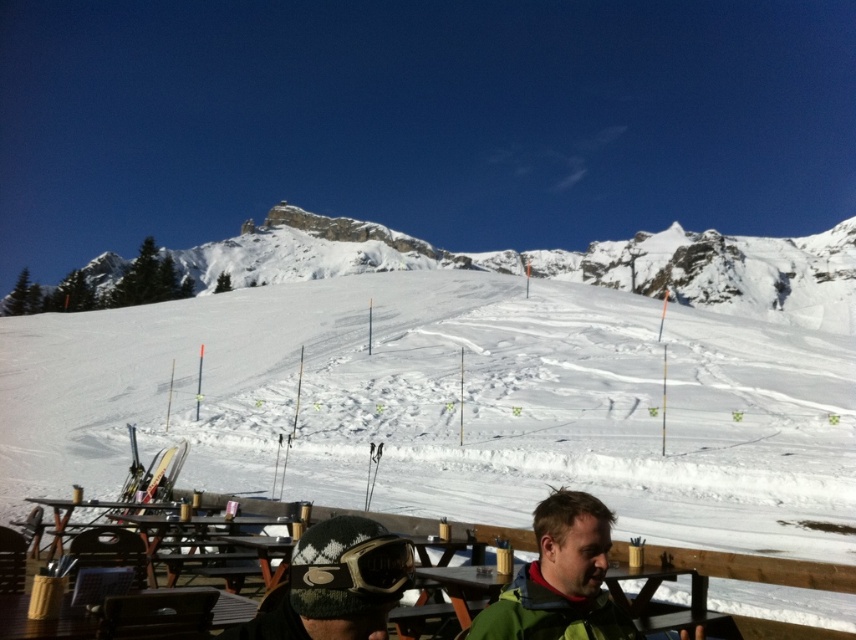
Question: Considering the real-world distances, which object is farthest from the matte black goggles at center?

Choices:
 (A) green knitted hat at lower center
 (B) white snow-covered mountain at upper center

Answer: (B)

Question: Which point is closer to the camera?

Choices:
 (A) white snow-covered mountain at upper center
 (B) matte black goggles at center

Answer: (B)

Question: Is white snow-covered mountain at upper center to the right of green woolen jacket at lower center from the viewer's perspective?

Choices:
 (A) yes
 (B) no

Answer: (A)

Question: Can you confirm if green woolen jacket at lower center is positioned below wooden picnic table at lower center?

Choices:
 (A) no
 (B) yes

Answer: (A)

Question: Is white powdery snow at center wider than wooden picnic table at lower center?

Choices:
 (A) yes
 (B) no

Answer: (A)

Question: Which is farther from the matte black goggles at center?

Choices:
 (A) white snow-covered mountain at upper center
 (B) green woolen jacket at lower center
 (C) white powdery snow at center

Answer: (A)